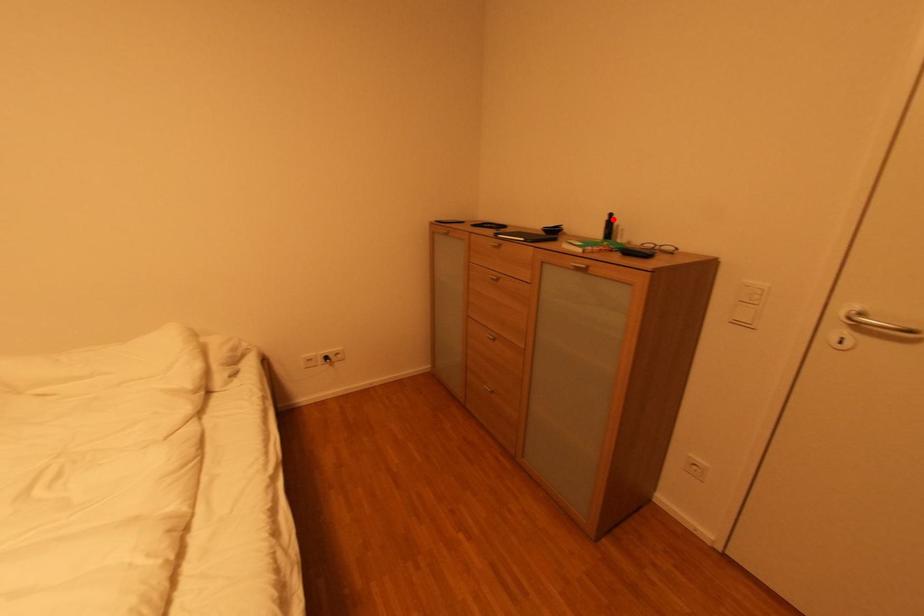
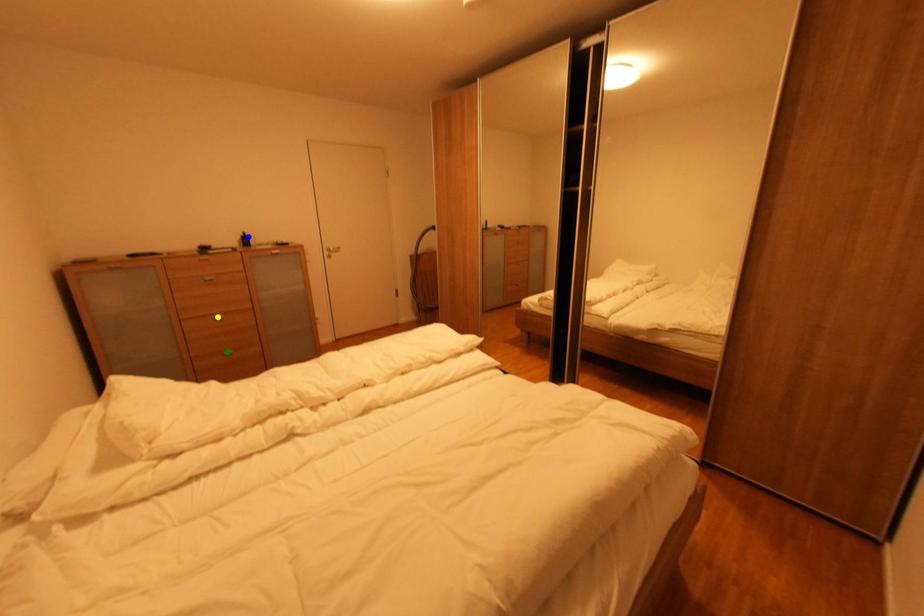
Question: I am providing you with two images of the same scene from different viewpoints. A red point is marked on the first image. You are given multiple points on the second image. In image 2, which mark is for the same physical point as the one in image 1?

Choices:
 (A) yellow point
 (B) blue point
 (C) green point

Answer: (B)